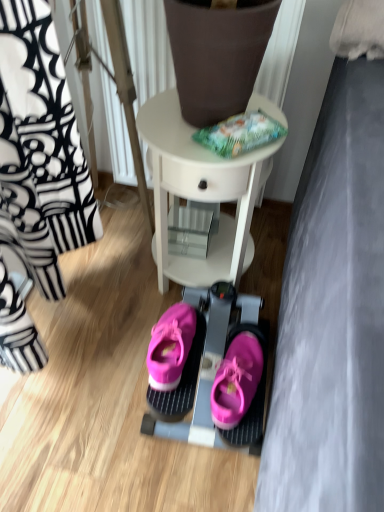
The height and width of the screenshot is (512, 384). I want to click on white glossy table at center, so click(199, 193).

From a real-world perspective, is pink suede sneakers at center above or below pink fabric sneakers at center?

From a real-world perspective, pink suede sneakers at center is physically above pink fabric sneakers at center.

From the image's perspective, is pink suede sneakers at center located beneath pink fabric sneakers at center?

Incorrect, from the image's perspective, pink suede sneakers at center is higher than pink fabric sneakers at center.

Where is `bunk bed that is on the right side of pink suede sneakers at center`? bunk bed that is on the right side of pink suede sneakers at center is located at coordinates (211, 372).

Considering the sizes of objects pink suede sneakers at center and white glossy table at center in the image provided, who is taller, pink suede sneakers at center or white glossy table at center?

With more height is white glossy table at center.

Is point (170, 326) positioned after point (153, 150)?

Yes, point (170, 326) is behind point (153, 150).

Could you tell me if pink suede sneakers at center is turned towards white glossy table at center?

No, pink suede sneakers at center is not aimed at white glossy table at center.

How different are the orientations of pink suede sneakers at center and white glossy table at center in degrees?

The facing directions of pink suede sneakers at center and white glossy table at center are 3.81e-05 degrees apart.

Considering the sizes of objects pink fabric sneakers at center and pink suede sneakers at center in the image provided, who is shorter, pink fabric sneakers at center or pink suede sneakers at center?

Standing shorter between the two is pink suede sneakers at center.

Can you confirm if pink fabric sneakers at center is smaller than pink suede sneakers at center?

No.

From a real-world perspective, between pink fabric sneakers at center and pink suede sneakers at center, who is vertically lower?

pink fabric sneakers at center is physically lower.

From the image's perspective, which object appears higher, pink fabric sneakers at center or pink suede sneakers at center?

pink suede sneakers at center is shown above in the image.

Locate an element on the screen. The image size is (384, 512). footwear lying behind the white glossy table at center is located at coordinates (170, 346).

From the image's perspective, is white glossy table at center positioned above or below pink suede sneakers at center?

white glossy table at center is situated higher than pink suede sneakers at center in the image.

Considering the sizes of white glossy table at center and pink suede sneakers at center in the image, is white glossy table at center bigger or smaller than pink suede sneakers at center?

Considering their sizes, white glossy table at center takes up more space than pink suede sneakers at center.

Does white glossy table at center come in front of pink suede sneakers at center?

Yes, the depth of white glossy table at center is less than that of pink suede sneakers at center.

From a real-world perspective, is white glossy table at center physically below pink fabric sneakers at center?

No, from a real-world perspective, white glossy table at center is not below pink fabric sneakers at center.

Can you tell me how much white glossy table at center and pink fabric sneakers at center differ in facing direction?

They differ by 8.01e-05 degrees in their facing directions.

Is white glossy table at center oriented away from pink fabric sneakers at center?

white glossy table at center is not turned away from pink fabric sneakers at center.

Between white glossy table at center and pink fabric sneakers at center, which one appears on the left side from the viewer's perspective?

white glossy table at center.

From the image's perspective, which is above, pink fabric sneakers at center or white glossy table at center?

white glossy table at center appears higher in the image.

Is pink fabric sneakers at center next to white glossy table at center and touching it?

pink fabric sneakers at center and white glossy table at center are not in contact.

Who is smaller, pink fabric sneakers at center or white glossy table at center?

pink fabric sneakers at center is smaller.

Where is `bunk bed below the pink suede sneakers at center (from a real-world perspective)`? The image size is (384, 512). bunk bed below the pink suede sneakers at center (from a real-world perspective) is located at coordinates (211, 372).

The image size is (384, 512). Find the location of `footwear to the left of white glossy table at center`. footwear to the left of white glossy table at center is located at coordinates (170, 346).

Looking at this image, looking at the image, which one is located closer to pink suede sneakers at center, pink fabric sneakers at center or white glossy table at center?

Based on the image, pink fabric sneakers at center appears to be nearer to pink suede sneakers at center.

Based on their spatial positions, is white glossy table at center or pink suede sneakers at center further from pink fabric sneakers at center?

white glossy table at center.

In the scene shown: Which object lies further to the anchor point pink suede sneakers at center, white glossy table at center or pink fabric sneakers at center?

white glossy table at center lies further to pink suede sneakers at center than the other object.

In the scene shown: Considering their positions, is pink suede sneakers at center positioned further to pink fabric sneakers at center than white glossy table at center?

Based on the image, white glossy table at center appears to be further to pink fabric sneakers at center.

Which object lies nearer to the anchor point white glossy table at center, pink fabric sneakers at center or pink suede sneakers at center?

pink fabric sneakers at center is closer to white glossy table at center.

From the image, which object appears to be farther from white glossy table at center, pink suede sneakers at center or pink fabric sneakers at center?

pink suede sneakers at center is positioned further to the anchor white glossy table at center.

This screenshot has width=384, height=512. I want to click on footwear between white glossy table at center and pink fabric sneakers at center in the up-down direction, so click(x=170, y=346).